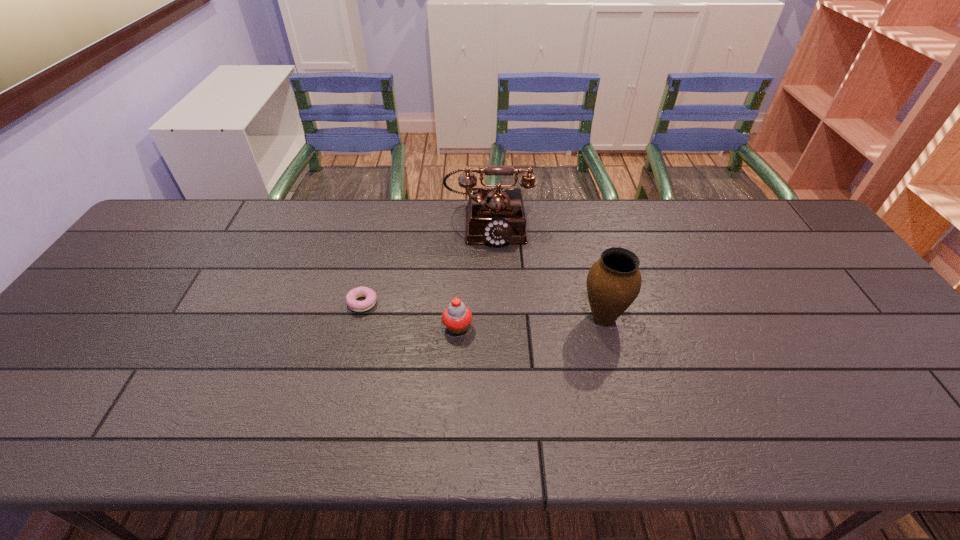
You are a GUI agent. You are given a task and a screenshot of the screen. Output one action in this format:
    pyautogui.click(x=<x>, y=<y>)
    Task: Click on the free space between the urn and the telephone
    
    Given the screenshot: What is the action you would take?
    pyautogui.click(x=546, y=269)

Where is `free point between the telephone and the rightmost object`? Image resolution: width=960 pixels, height=540 pixels. free point between the telephone and the rightmost object is located at coordinates (546, 269).

The width and height of the screenshot is (960, 540). I want to click on vacant area that lies between the rightmost object and the shortest object, so click(x=483, y=309).

Locate an element on the screen. This screenshot has width=960, height=540. free spot between the urn and the doughnut is located at coordinates (483, 309).

At what (x,y) coordinates should I click in order to perform the action: click on blank region between the urn and the cupcake. Please return your answer as a coordinate pair (x, y). Image resolution: width=960 pixels, height=540 pixels. Looking at the image, I should click on (531, 322).

Find the location of a particular element. unoccupied position between the farthest object and the third tallest object is located at coordinates (473, 275).

At what (x,y) coordinates should I click in order to perform the action: click on object that ranks as the closest to the shortest object. Please return your answer as a coordinate pair (x, y). The width and height of the screenshot is (960, 540). Looking at the image, I should click on (457, 317).

Locate an element on the screen. The height and width of the screenshot is (540, 960). the closest object to the urn is located at coordinates (496, 216).

Where is `vacant space that satisfies the following two spatial constraints: 1. on the back side of the urn; 2. on the left side of the third tallest object`? The height and width of the screenshot is (540, 960). vacant space that satisfies the following two spatial constraints: 1. on the back side of the urn; 2. on the left side of the third tallest object is located at coordinates (458, 316).

Identify the location of free point that satisfies the following two spatial constraints: 1. on the back side of the urn; 2. on the left side of the cupcake. (458, 316).